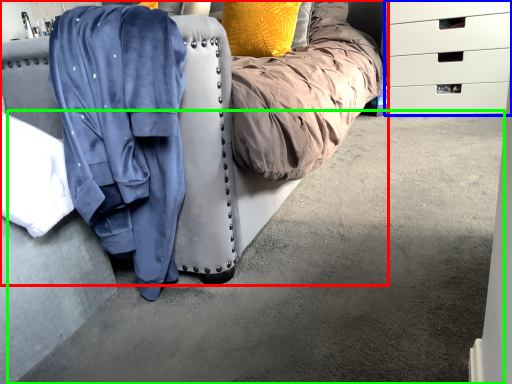
Question: Considering the real-world distances, which object is closest to furniture (highlighted by a red box)? chest of drawers (highlighted by a blue box) or concrete (highlighted by a green box).

Choices:
 (A) chest of drawers
 (B) concrete

Answer: (B)